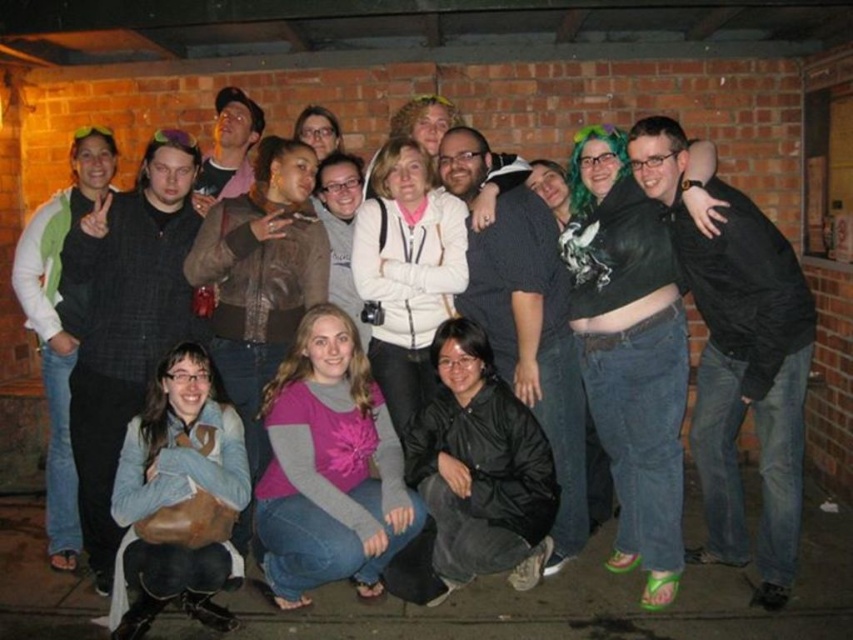
You are a photographer trying to adjust the lighting for a group photo. You have a spotlight that can only illuminate objects to the right of the black matte jacket at center. Will the leather brown purse at lower left be lit by this spotlight?

The leather brown purse at lower left is to the left of the black matte jacket at center, so it will not be lit by the spotlight since it is positioned to the right of the jacket.

You are a photographer trying to adjust the spacing between two people wearing matte black jackets in the photo. The two people are the matte black jacket at left and the matte black jacket at center. If you want to make sure they are exactly 1 meter apart for a better composition, should you move them closer or farther apart?

The current distance between the matte black jacket at left and the matte black jacket at center is 1.06 meters. To achieve exactly 1 meter, you should move them slightly closer together.